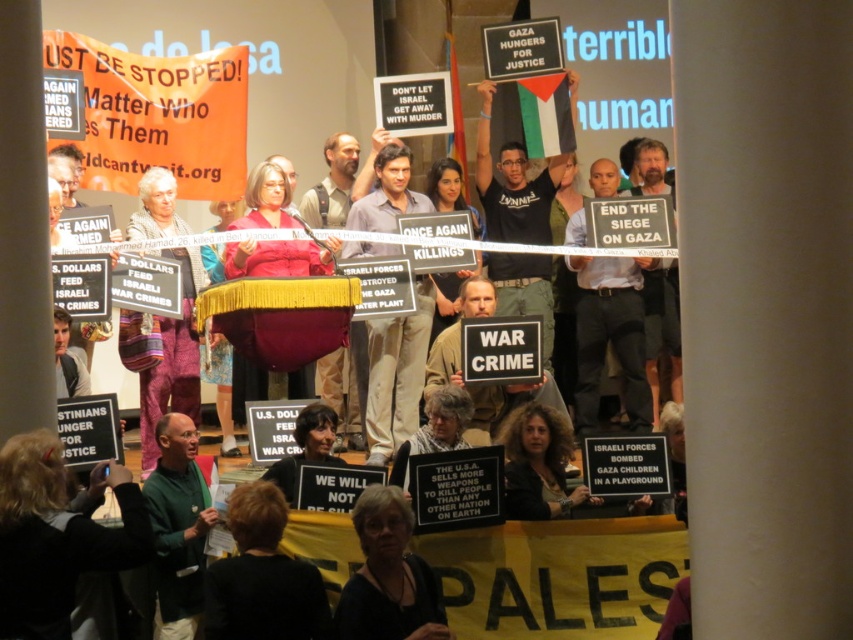
Is white paper sign at center positioned at the back of black fabric sign at center-right?

No.

Based on the photo, does white paper sign at center have a lesser height compared to black fabric sign at center-right?

Correct, white paper sign at center is not as tall as black fabric sign at center-right.

You are a GUI agent. You are given a task and a screenshot of the screen. Output one action in this format:
    pyautogui.click(x=<x>, y=<y>)
    Task: Click on the white paper sign at center
    The image size is (853, 640).
    Given the screenshot: What is the action you would take?
    click(x=558, y=577)